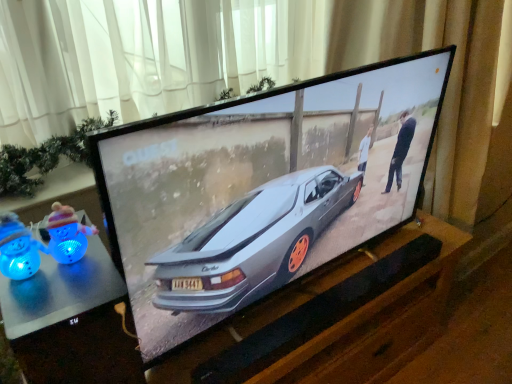
Locate an element on the screen. free point above metallic silver table at lower left (from a real-world perspective) is located at coordinates (67, 281).